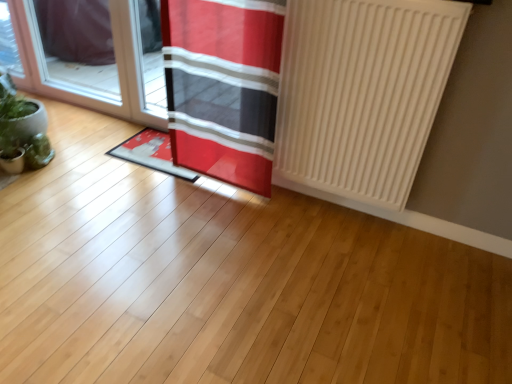
Question: Should I look upward or downward to see green matte plant at left?

Choices:
 (A) down
 (B) up

Answer: (B)

Question: From the image's perspective, is red fabric curtain at center below green matte plant at left?

Choices:
 (A) yes
 (B) no

Answer: (B)

Question: Does red fabric curtain at center have a smaller size compared to green matte plant at left?

Choices:
 (A) yes
 (B) no

Answer: (B)

Question: Is red fabric curtain at center taller than green matte plant at left?

Choices:
 (A) yes
 (B) no

Answer: (A)

Question: Considering the relative sizes of red fabric curtain at center and green matte plant at left in the image provided, is red fabric curtain at center bigger than green matte plant at left?

Choices:
 (A) no
 (B) yes

Answer: (B)

Question: Is red fabric curtain at center next to green matte plant at left?

Choices:
 (A) no
 (B) yes

Answer: (A)

Question: Is red fabric curtain at center oriented towards green matte plant at left?

Choices:
 (A) no
 (B) yes

Answer: (A)

Question: Is green matte plant at left taller than red fabric doormat at center?

Choices:
 (A) yes
 (B) no

Answer: (A)

Question: From the image's perspective, is green matte plant at left over red fabric doormat at center?

Choices:
 (A) no
 (B) yes

Answer: (A)

Question: Is red fabric doormat at center located within green matte plant at left?

Choices:
 (A) no
 (B) yes

Answer: (A)

Question: Can you confirm if green matte plant at left is bigger than red fabric doormat at center?

Choices:
 (A) no
 (B) yes

Answer: (A)

Question: Is green matte plant at left positioned behind red fabric doormat at center?

Choices:
 (A) no
 (B) yes

Answer: (A)

Question: Is green matte plant at left not within red fabric doormat at center?

Choices:
 (A) yes
 (B) no

Answer: (A)

Question: Would you say green matte plant at left is part of white matte radiator at right's contents?

Choices:
 (A) no
 (B) yes

Answer: (A)